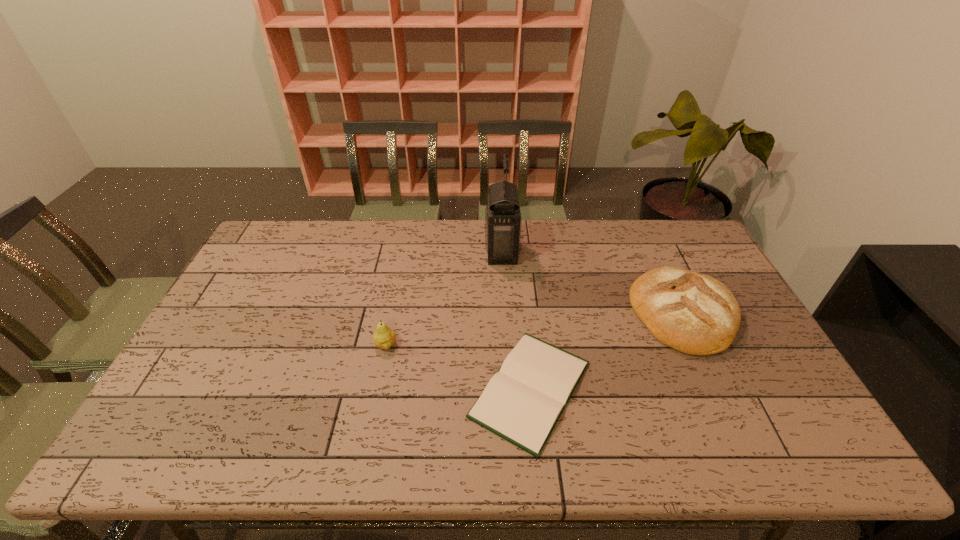
Identify the location of free spot that satisfies the following two spatial constraints: 1. on the front-facing side of the farthest object; 2. on the left side of the shortest object. (510, 389).